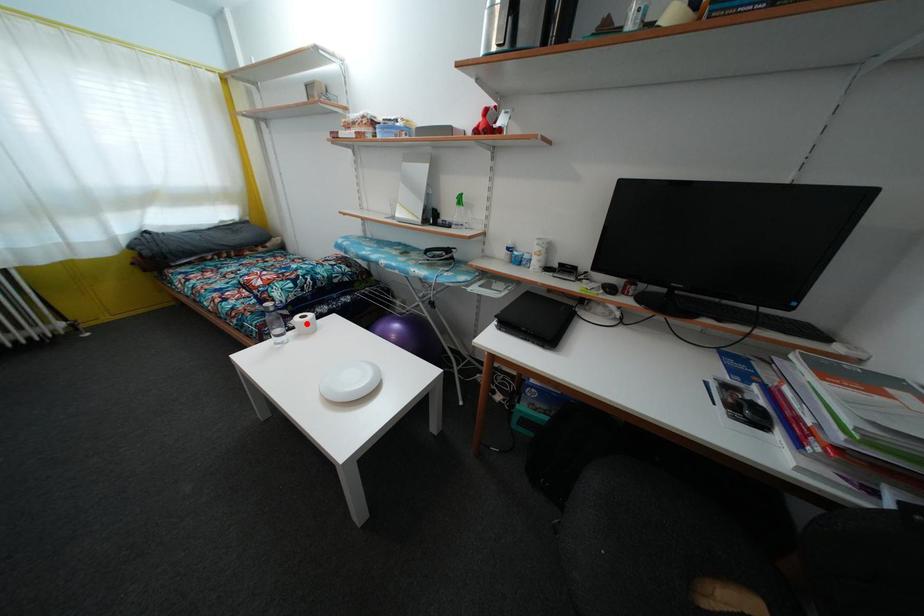
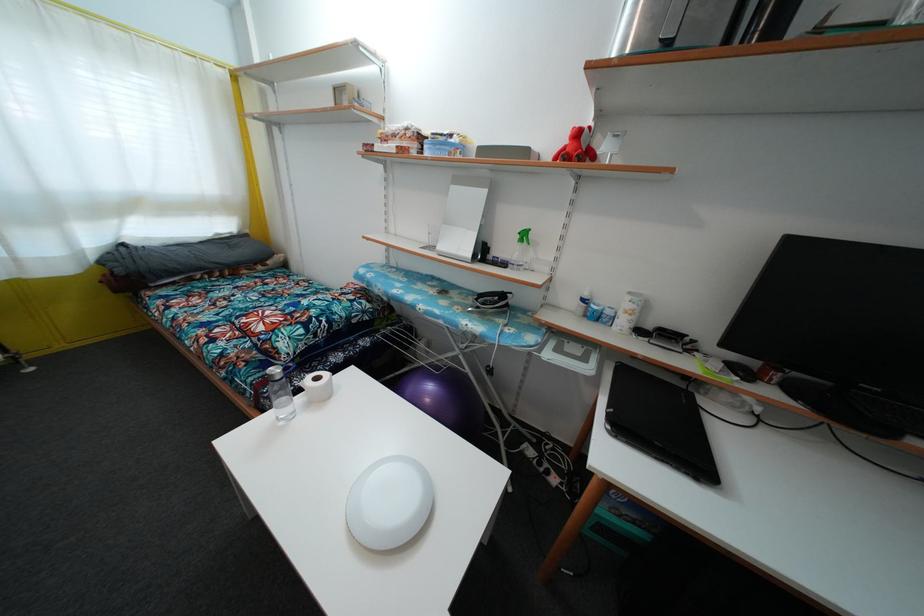
In the second image, find the point that corresponds to the highlighted location in the first image.

(321, 386)